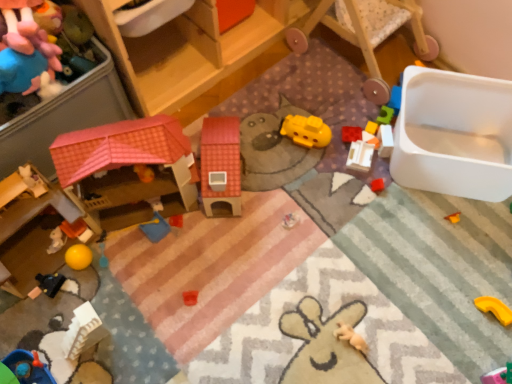
Locate an element on the screen. The height and width of the screenshot is (384, 512). free area in between yellow matte block at upper right, the ninth toy when ordered from left to right, and light brown plush toy at lower right, the sixth toy from the right is located at coordinates (357, 247).